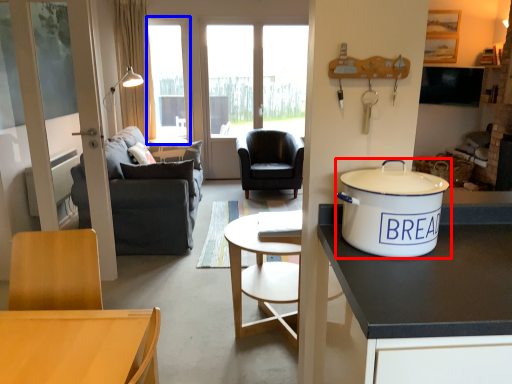
Question: Which point is closer to the camera, tableware (highlighted by a red box) or window (highlighted by a blue box)?

Choices:
 (A) tableware
 (B) window

Answer: (A)